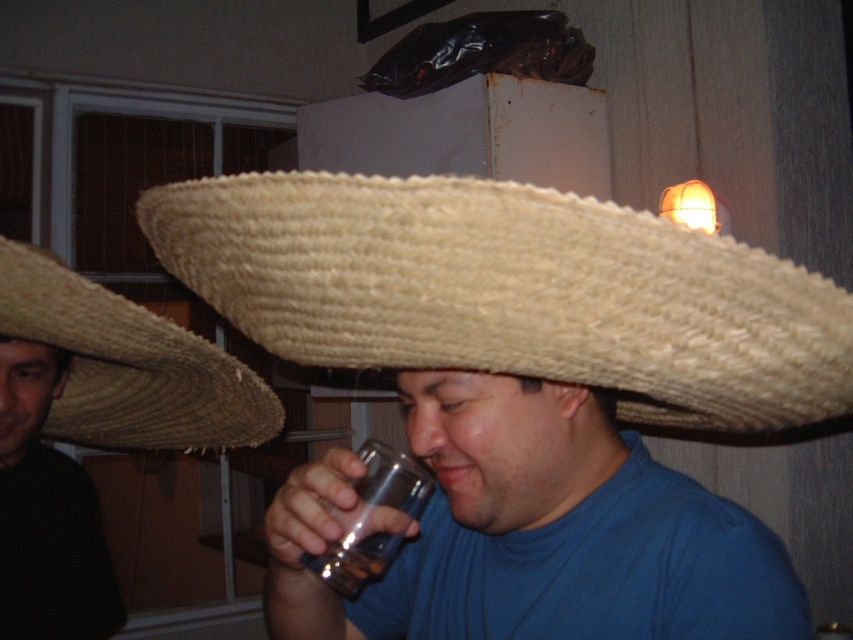
Question: Which object is positioned farthest from the woven straw sombrero at upper left?

Choices:
 (A) woven straw sombrero at left
 (B) transparent glass at lower center
 (C) natural straw sombrero at center

Answer: (C)

Question: Which point appears closest to the camera in this image?

Choices:
 (A) (91, 573)
 (B) (254, 227)
 (C) (196, 348)
 (D) (379, 484)

Answer: (B)

Question: Where is natural straw sombrero at center located in relation to woven straw sombrero at upper left in the image?

Choices:
 (A) below
 (B) above

Answer: (B)

Question: Can you confirm if woven straw sombrero at upper left is positioned to the right of transparent glass at lower center?

Choices:
 (A) yes
 (B) no

Answer: (B)

Question: Which is nearer to the woven straw sombrero at left?

Choices:
 (A) woven straw sombrero at upper left
 (B) natural straw sombrero at center

Answer: (A)

Question: Is natural straw sombrero at center bigger than transparent glass at lower center?

Choices:
 (A) yes
 (B) no

Answer: (A)